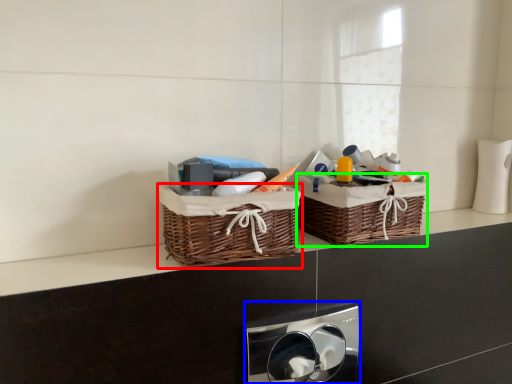
Question: Considering the real-world distances, which object is farthest from picnic basket (highlighted by a red box)? appliance (highlighted by a blue box) or picnic basket (highlighted by a green box)?

Choices:
 (A) appliance
 (B) picnic basket

Answer: (A)